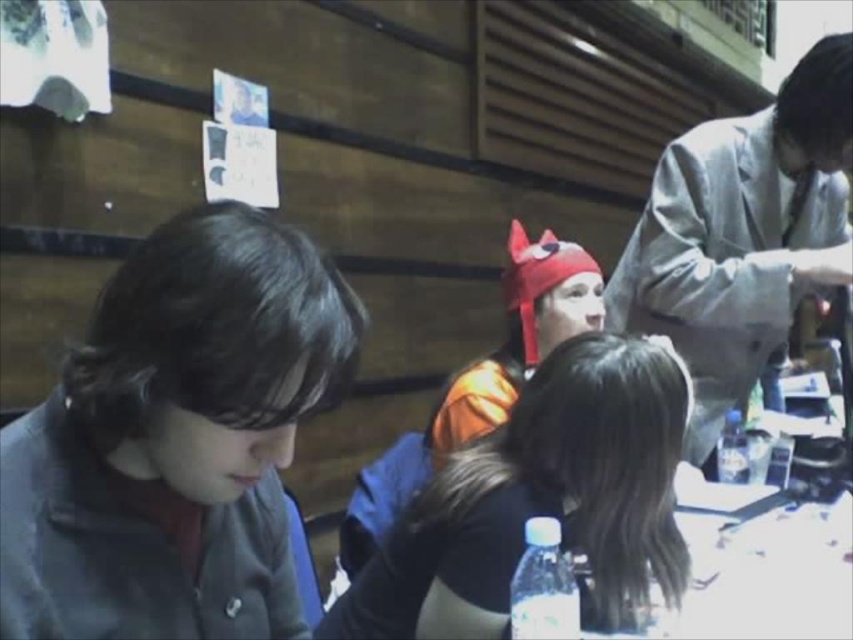
Question: Which object appears farthest from the camera in this image?

Choices:
 (A) gray fabric suit at upper right
 (B) dark gray fabric at left

Answer: (A)

Question: Which point is closer to the camera?

Choices:
 (A) orange fabric mask at center
 (B) dark gray fabric at left

Answer: (B)

Question: Does dark gray fabric at left have a smaller size compared to orange fabric mask at center?

Choices:
 (A) no
 (B) yes

Answer: (B)

Question: Based on their relative distances, which object is farther from the orange fabric mask at center?

Choices:
 (A) dark gray fabric at left
 (B) gray fabric suit at upper right

Answer: (B)

Question: Where is orange fabric mask at center located in relation to gray fabric suit at upper right in the image?

Choices:
 (A) right
 (B) left

Answer: (B)

Question: Where is dark gray fabric at left located in relation to orange fabric mask at center in the image?

Choices:
 (A) left
 (B) right

Answer: (A)